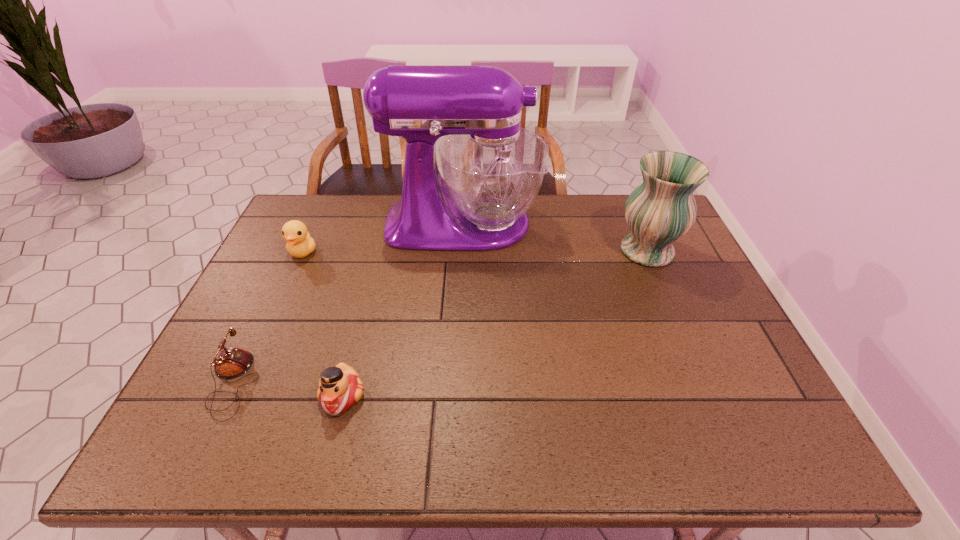
Image resolution: width=960 pixels, height=540 pixels. I want to click on empty space between the tallest object and the shortest object, so click(348, 303).

Find the location of a particular element. The width and height of the screenshot is (960, 540). empty space that is in between the shortest object and the right duck is located at coordinates (287, 389).

Locate an element on the screen. This screenshot has width=960, height=540. empty space that is in between the left duck and the telephone is located at coordinates (268, 317).

Where is `vacant space that is in between the mixer and the rightmost object`? The image size is (960, 540). vacant space that is in between the mixer and the rightmost object is located at coordinates (555, 237).

Locate an element on the screen. The image size is (960, 540). vacant space in between the telephone and the mixer is located at coordinates (348, 303).

At what (x,y) coordinates should I click in order to perform the action: click on vacant space that's between the second tallest object and the shortest object. Please return your answer as a coordinate pair (x, y). The image size is (960, 540). Looking at the image, I should click on (440, 316).

Choose which object is the fourth nearest neighbor to the left duck. Please provide its 2D coordinates. Your answer should be formatted as a tuple, i.e. [(x, y)], where the tuple contains the x and y coordinates of a point satisfying the conditions above.

[(661, 210)]

Identify which object is located as the second nearest to the tallest object. Please provide its 2D coordinates. Your answer should be formatted as a tuple, i.e. [(x, y)], where the tuple contains the x and y coordinates of a point satisfying the conditions above.

[(661, 210)]

Locate an element on the screen. The width and height of the screenshot is (960, 540). free space that satisfies the following two spatial constraints: 1. on the face of the left duck; 2. on the rotary dial of the telephone is located at coordinates (244, 382).

The width and height of the screenshot is (960, 540). I want to click on vacant space that satisfies the following two spatial constraints: 1. at the bowl opening of the mixer; 2. on the face of the farther duck, so click(462, 252).